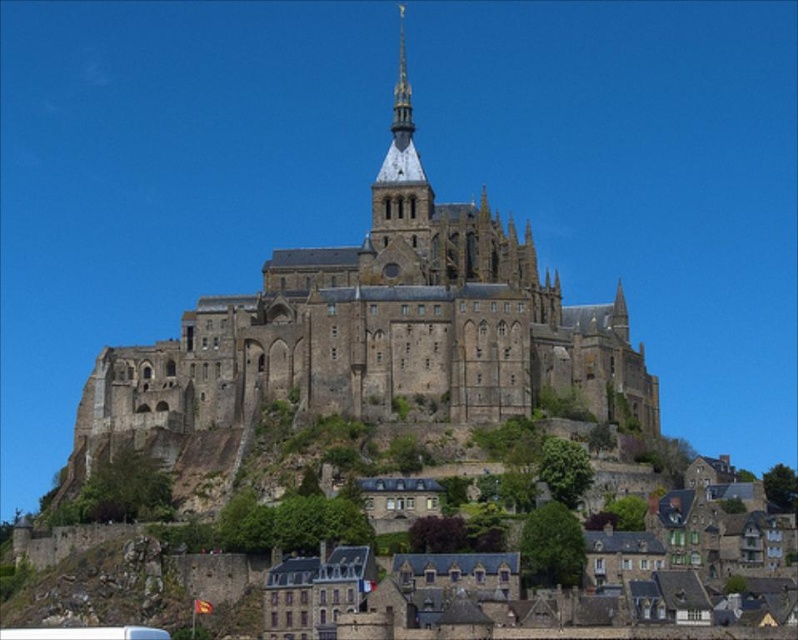
Question: Which of the following is the farthest from the observer?

Choices:
 (A) click(x=346, y=336)
 (B) click(x=91, y=632)

Answer: (A)

Question: Where is stone castle at center located in relation to white plastic bus at lower left in the image?

Choices:
 (A) left
 (B) right

Answer: (B)

Question: Can you confirm if stone castle at center is bigger than white plastic bus at lower left?

Choices:
 (A) yes
 (B) no

Answer: (A)

Question: Does stone castle at center appear under white plastic bus at lower left?

Choices:
 (A) yes
 (B) no

Answer: (B)

Question: Which object is farther from the camera taking this photo?

Choices:
 (A) stone castle at center
 (B) white plastic bus at lower left

Answer: (A)